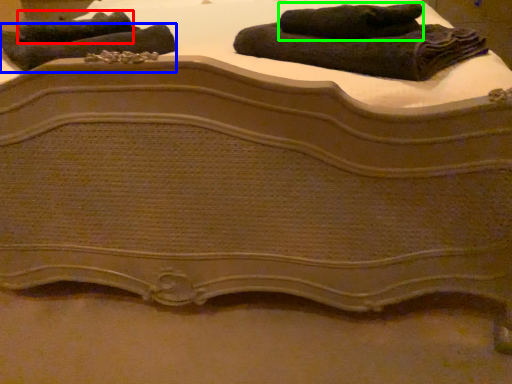
Question: Which is farther away from towel (highlighted by a red box)? towel (highlighted by a blue box) or towel (highlighted by a green box)?

Choices:
 (A) towel
 (B) towel

Answer: (B)